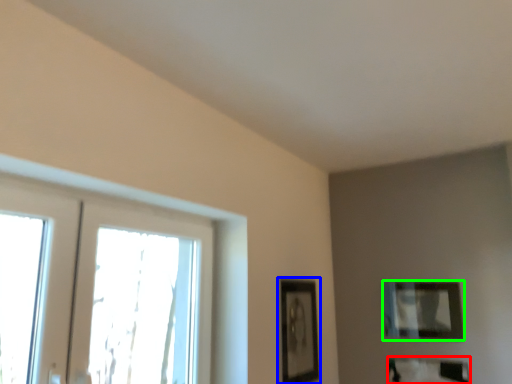
Question: Which object is positioned closest to picture frame (highlighted by a red box)? Select from picture frame (highlighted by a blue box) and picture frame (highlighted by a green box).

Choices:
 (A) picture frame
 (B) picture frame

Answer: (B)